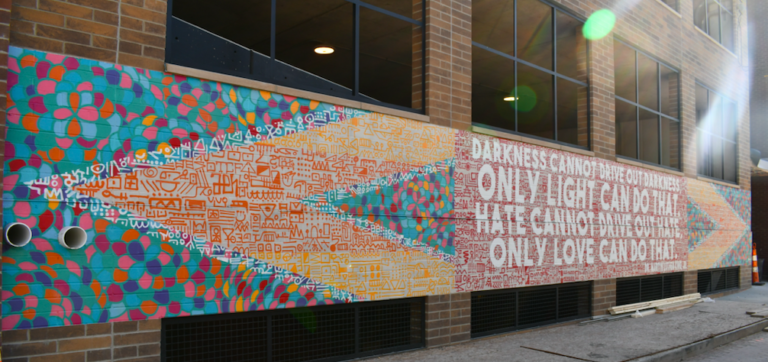
In order to click on windows in this screenshot , I will do `click(353, 54)`, `click(550, 62)`, `click(641, 96)`, `click(714, 139)`, `click(527, 313)`, `click(260, 341)`.